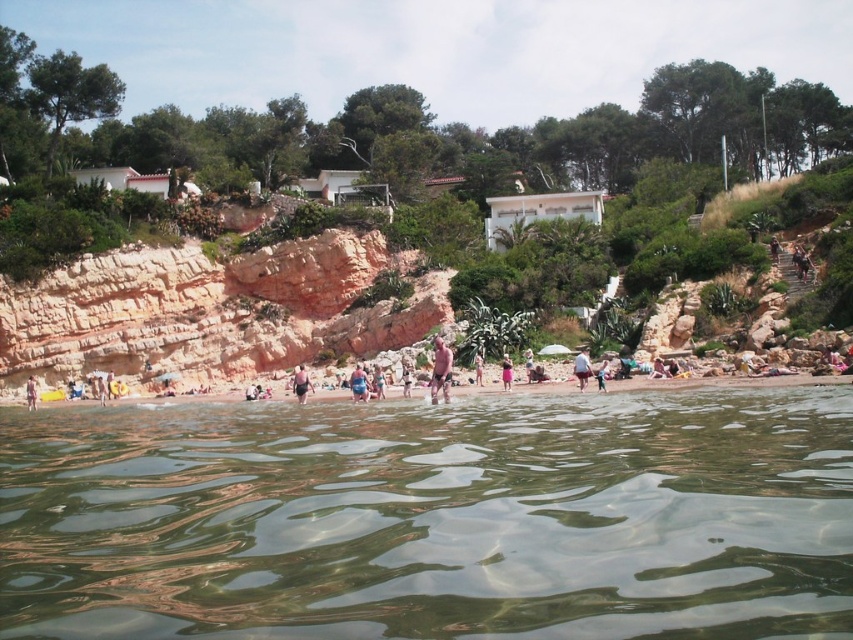
Question: Is blue denim shorts at center behind tan skin human at center?

Choices:
 (A) no
 (B) yes

Answer: (A)

Question: Is blue denim shorts at center positioned behind light pink fabric dress at center?

Choices:
 (A) yes
 (B) no

Answer: (A)

Question: Which of the following is the farthest from the observer?

Choices:
 (A) (503, 365)
 (B) (436, 403)
 (C) (22, 316)
 (D) (33, 404)

Answer: (C)

Question: Can you confirm if smooth tan skin at upper right is positioned to the right of tan skin human at center?

Choices:
 (A) no
 (B) yes

Answer: (B)

Question: Which of the following is the farthest from the observer?

Choices:
 (A) (506, 360)
 (B) (112, 333)
 (C) (445, 397)

Answer: (B)

Question: Which point is closer to the camera?

Choices:
 (A) (437, 364)
 (B) (15, 324)

Answer: (A)